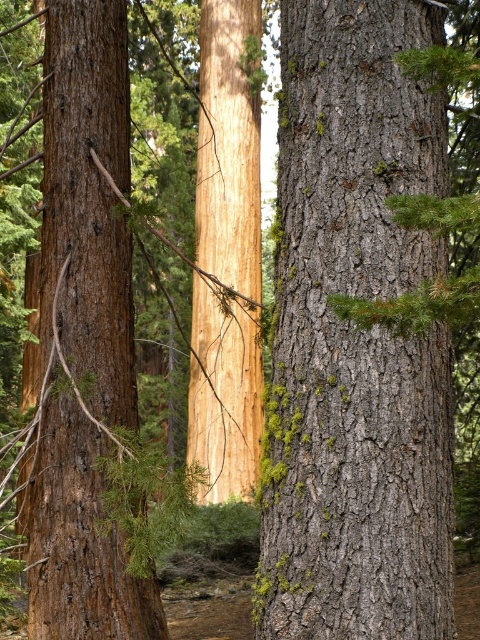
Looking at this image, you are a hiker trying to identify landmarks in the forest. You see the gray rough bark tree trunk at center and the smooth brown bark at left. Which one is positioned lower in the image?

The gray rough bark tree trunk at center is located below the smooth brown bark at left, so it is positioned lower in the image.

Based on the scene description, where is the gray rough bark tree trunk at center located in the image?

The gray rough bark tree trunk at center is located at the 2D coordinates point (355, 339) in the image.